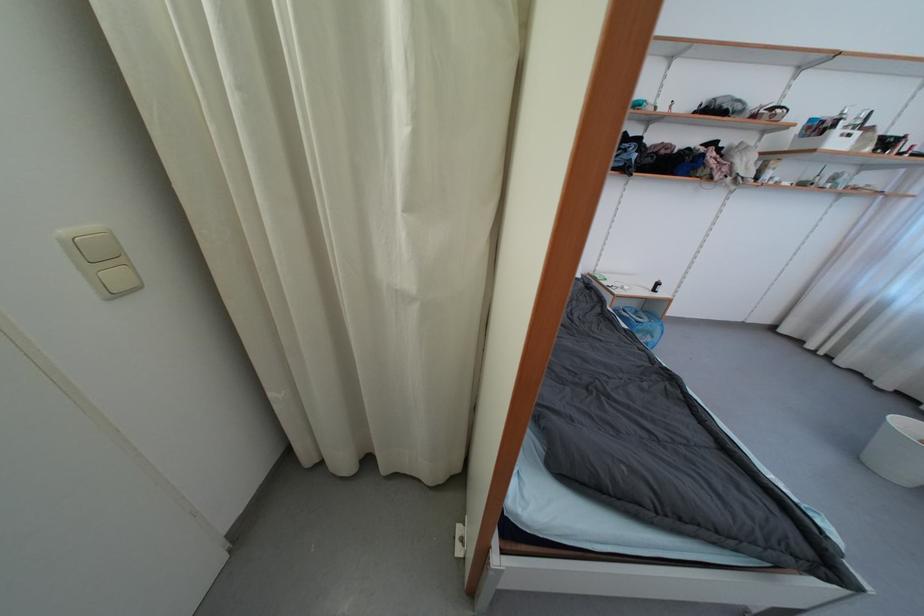
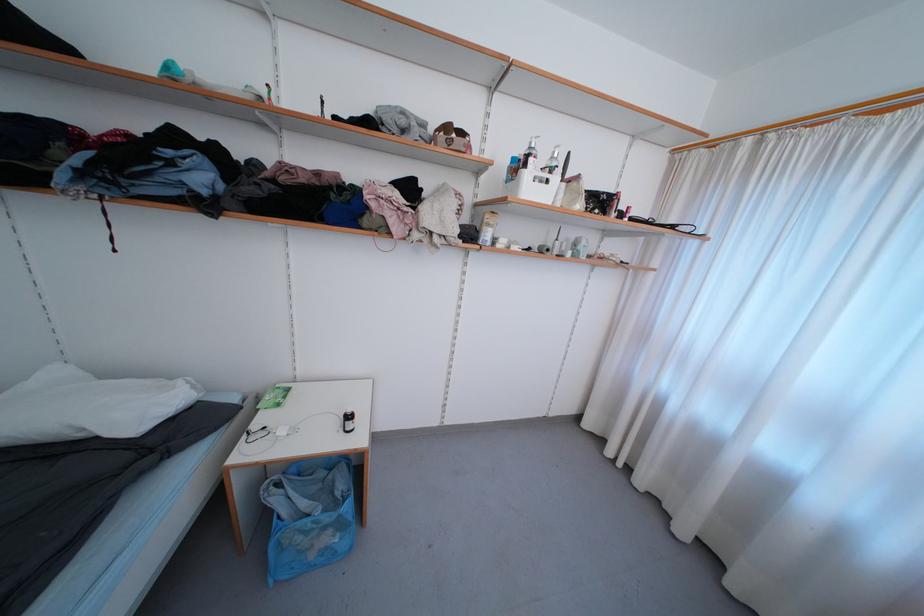
The point at [840,135] is marked in the first image. Where is the corresponding point in the second image?

(531, 177)